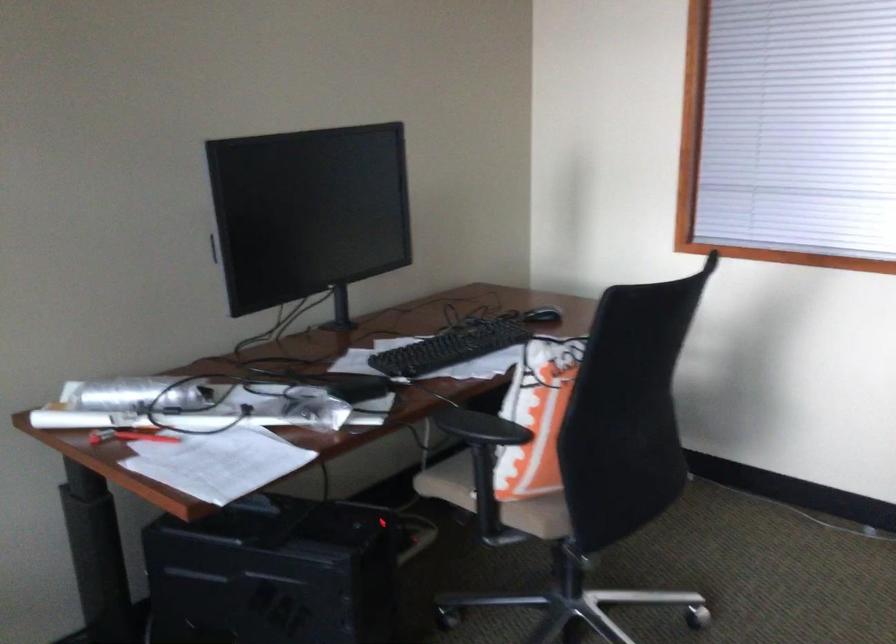
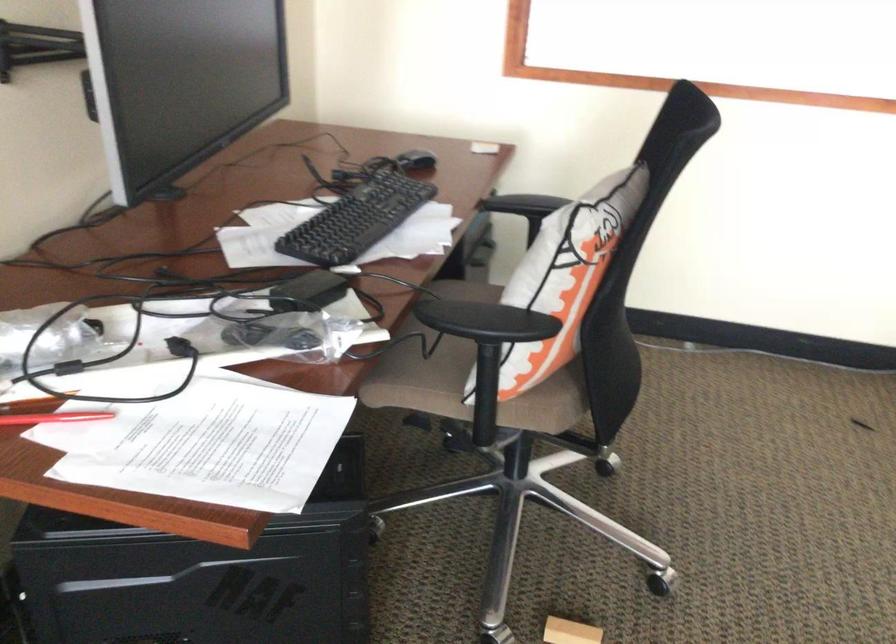
Where in the second image is the point corresponding to pixel 438 348 from the first image?

(356, 220)